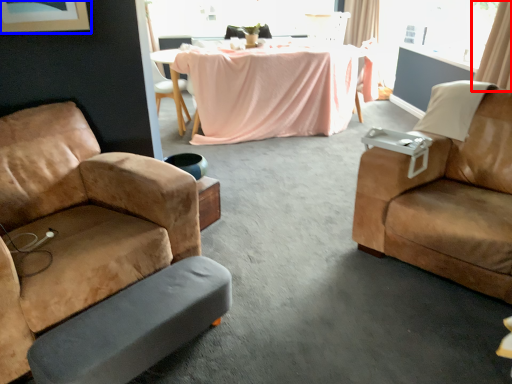
Question: Which object is closer to the camera taking this photo, curtain (highlighted by a red box) or picture frame (highlighted by a blue box)?

Choices:
 (A) curtain
 (B) picture frame

Answer: (B)